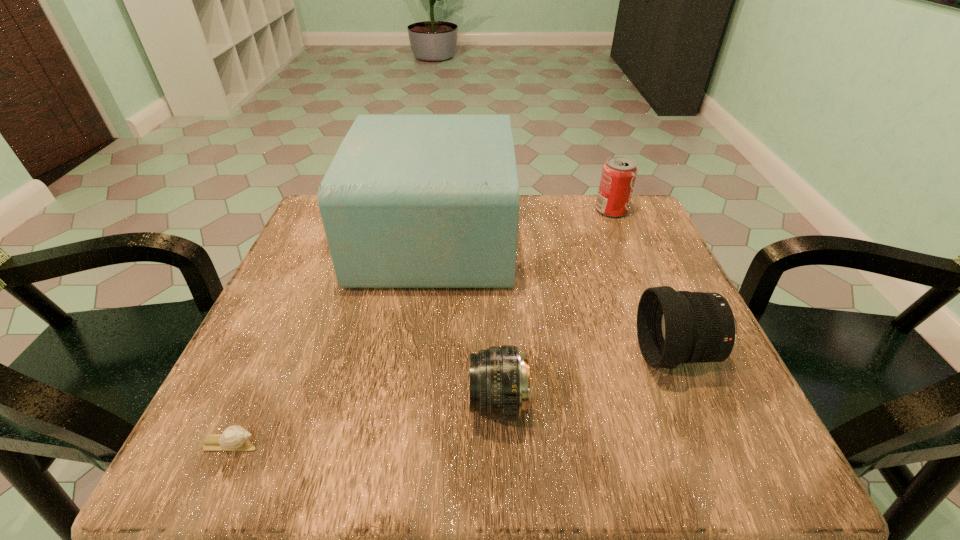
Locate an element on the screen. The height and width of the screenshot is (540, 960). radio receiver is located at coordinates (409, 201).

The image size is (960, 540). Identify the location of soda can. (619, 173).

Where is `the taller telephoto lens`? the taller telephoto lens is located at coordinates (673, 327).

This screenshot has width=960, height=540. What are the coordinates of `the left telephoto lens` in the screenshot? It's located at (500, 389).

In order to click on the shorter telephoto lens in this screenshot , I will do `click(500, 389)`.

Find the location of a particular element. The width and height of the screenshot is (960, 540). the shortest object is located at coordinates (234, 438).

I want to click on the leftmost object, so click(x=234, y=438).

The image size is (960, 540). In order to click on vacant space located 0.290m on the front panel of the radio receiver in this screenshot , I will do `click(635, 237)`.

Find the location of a particular element. The image size is (960, 540). vacant point located on the front of the soda can is located at coordinates (655, 316).

Where is `free space located at the front element of the right telephoto lens`? The image size is (960, 540). free space located at the front element of the right telephoto lens is located at coordinates (600, 354).